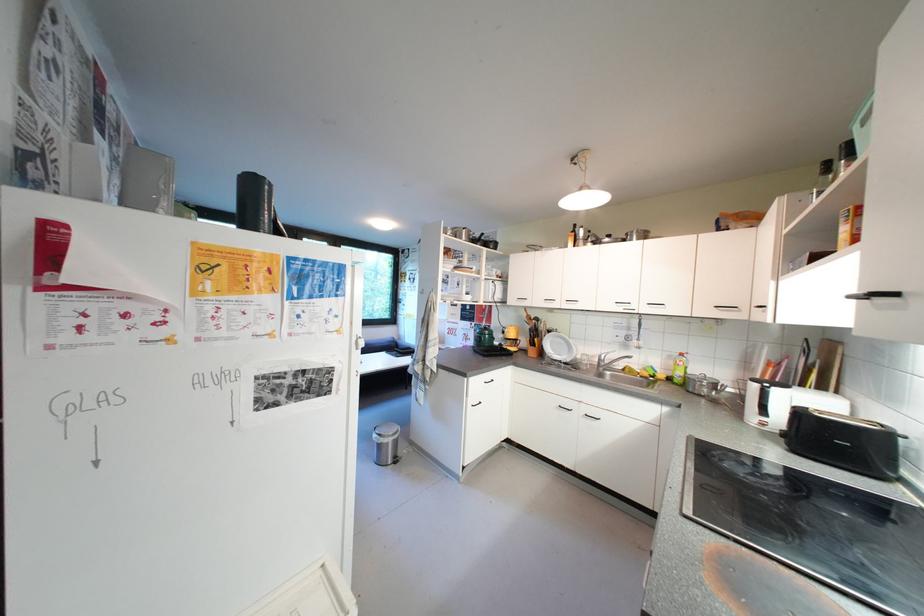
Find where to lift the dish soap bottle. Please return your answer as a coordinate pair (x, y).

(678, 369)